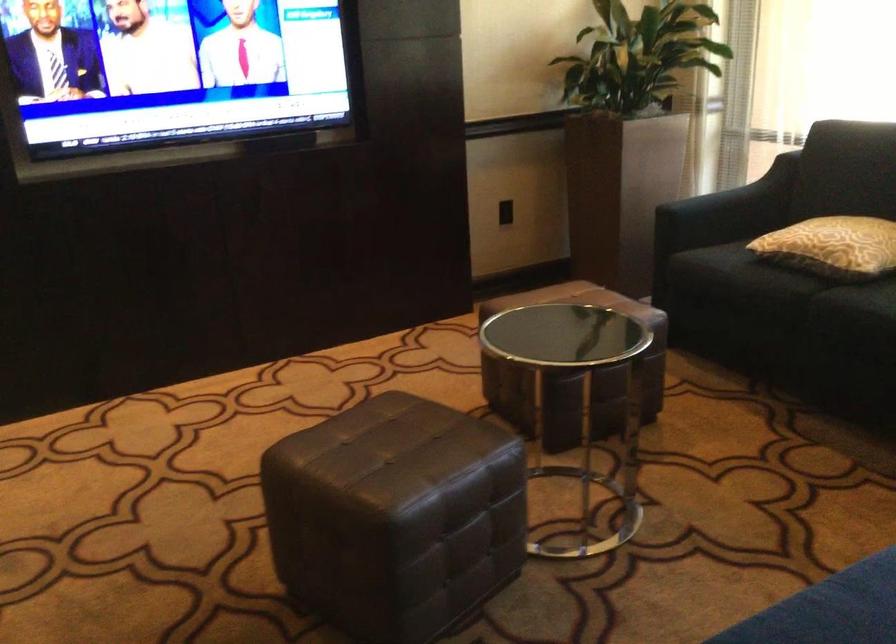
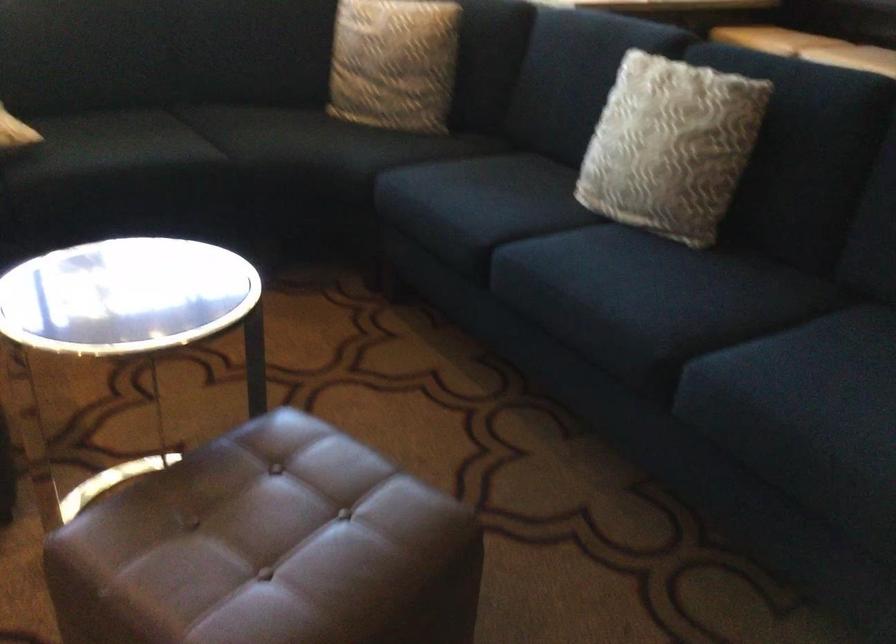
The point at (394,516) is marked in the first image. Where is the corresponding point in the second image?

(474, 493)